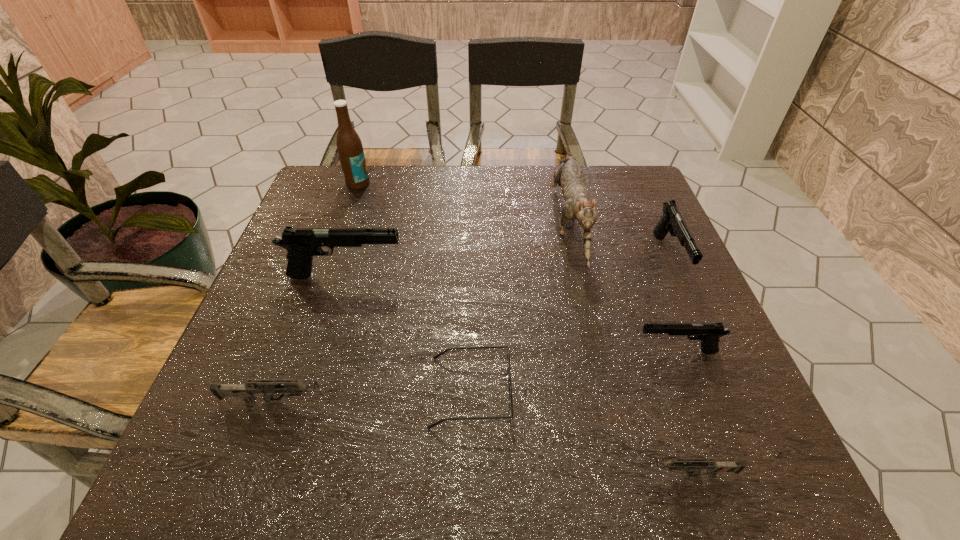
I want to click on the fourth object from left to right, so click(x=508, y=355).

At what (x,y) coordinates should I click in order to perform the action: click on the nearest object. Please return your answer as a coordinate pair (x, y). The image size is (960, 540). Looking at the image, I should click on (695, 465).

Identify the location of the shortest gun. This screenshot has height=540, width=960. (695, 465).

Find the location of a particular element. vacant space located on the left of the beer bottle is located at coordinates (329, 184).

The image size is (960, 540). In order to click on vacant space located 0.280m on the face of the cat in this screenshot , I will do `click(603, 378)`.

At what (x,y) coordinates should I click in order to perform the action: click on vacant space positioned at the aiming end of the leftmost black gun. Please return your answer as a coordinate pair (x, y). This screenshot has width=960, height=540. Looking at the image, I should click on (561, 276).

Locate an element on the screen. This screenshot has height=540, width=960. vacant space located at the aiming end of the fourth tallest object is located at coordinates (709, 349).

Where is `free space located 0.070m at the aiming end of the third nearest gun`? free space located 0.070m at the aiming end of the third nearest gun is located at coordinates pyautogui.click(x=600, y=352).

Find the location of a particular element. This screenshot has width=960, height=540. free space located at the aiming end of the third nearest gun is located at coordinates (452, 352).

At what (x,y) coordinates should I click in order to perform the action: click on vacant space located 0.380m at the aiming end of the third nearest gun. Please return your answer as a coordinate pair (x, y). Looking at the image, I should click on (443, 352).